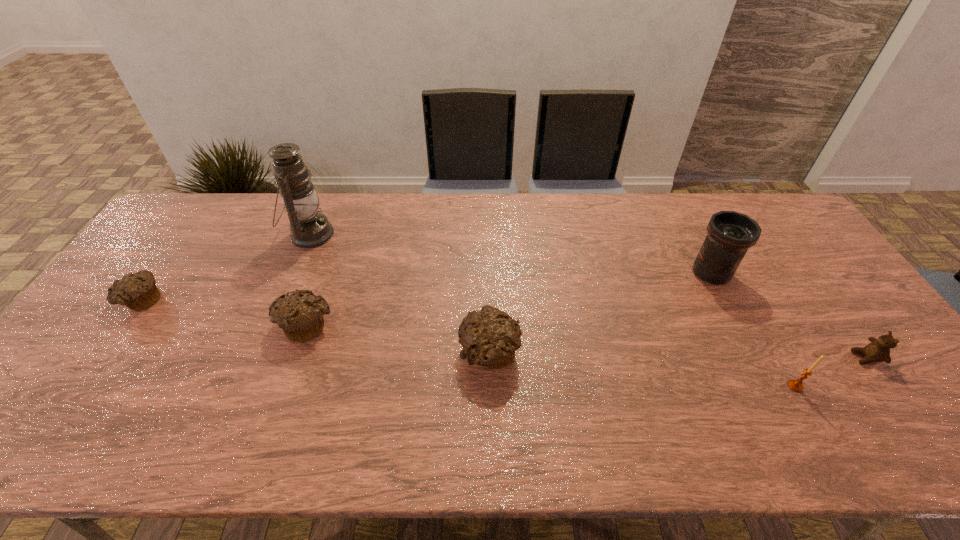
Identify the location of free location located 0.170m on the left of the second muffin from right to left. Image resolution: width=960 pixels, height=540 pixels. (215, 325).

Locate an element on the screen. free spot located on the back of the rightmost muffin is located at coordinates (488, 237).

The height and width of the screenshot is (540, 960). I want to click on free space located 0.380m on the left of the oil lamp, so click(x=171, y=234).

Where is `free point located at the face of the teddy bear`? Image resolution: width=960 pixels, height=540 pixels. free point located at the face of the teddy bear is located at coordinates (755, 357).

Identify the location of free space located at the face of the teddy bear. (810, 357).

Where is `vacant area situated at the face of the teddy bear`? vacant area situated at the face of the teddy bear is located at coordinates (715, 357).

You are a GUI agent. You are given a task and a screenshot of the screen. Output one action in this format:
    pyautogui.click(x=<x>, y=<y>)
    Task: Click on the vacant space situated on the front of the second tallest object
    
    Given the screenshot: What is the action you would take?
    (732, 315)

Find the location of a particular element. The width and height of the screenshot is (960, 540). free spot located 0.130m on the back of the candle_holder is located at coordinates pyautogui.click(x=768, y=336).

You are a GUI agent. You are given a task and a screenshot of the screen. Output one action in this format:
    pyautogui.click(x=<x>, y=<y>)
    Task: Click on the object present at the far edge
    
    Given the screenshot: What is the action you would take?
    pyautogui.click(x=309, y=228)

Locate an element on the screen. This screenshot has height=540, width=960. muffin located in the near edge section of the desktop is located at coordinates (490, 337).